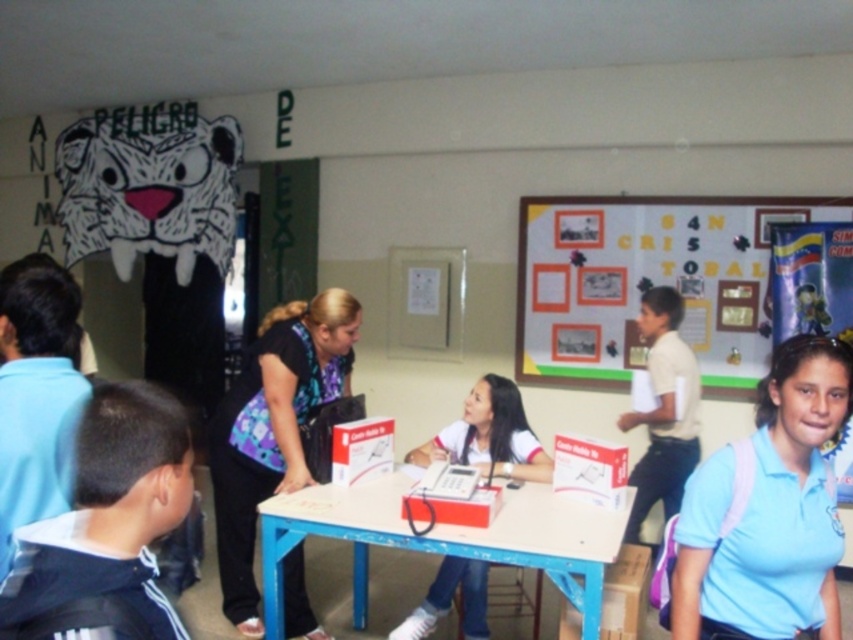
Question: Estimate the real-world distances between objects in this image. Which object is farther from the light blue shirt at lower right?

Choices:
 (A) white paperboard bulletin board at upper right
 (B) white matte uniform at center

Answer: (A)

Question: Is light blue shirt at lower right smaller than white plastic table at center?

Choices:
 (A) yes
 (B) no

Answer: (A)

Question: Estimate the real-world distances between objects in this image. Which object is farther from the white paperboard bulletin board at upper right?

Choices:
 (A) white matte uniform at center
 (B) white plastic table at center
 (C) white shirt at right
 (D) blue printed blouse at center

Answer: (D)

Question: In this image, where is white paperboard bulletin board at upper right located relative to white matte uniform at center?

Choices:
 (A) left
 (B) right

Answer: (B)

Question: Which point is closer to the camera?

Choices:
 (A) blue printed blouse at center
 (B) white shirt at right
 (C) light blue shirt at lower right

Answer: (C)

Question: Does blue fabric backpack at lower left have a larger size compared to white matte uniform at center?

Choices:
 (A) yes
 (B) no

Answer: (B)